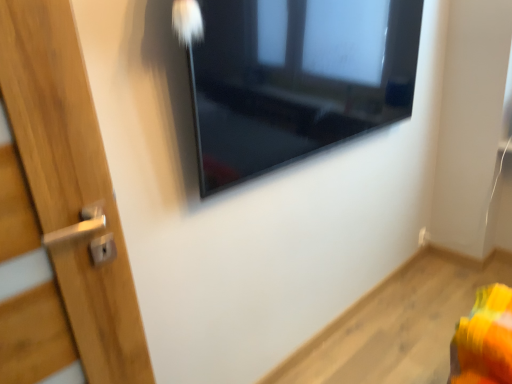
Question: Is white plastic electric outlet at lower right shorter than glossy glass window at upper center?

Choices:
 (A) yes
 (B) no

Answer: (A)

Question: Is white plastic electric outlet at lower right looking in the opposite direction of glossy glass window at upper center?

Choices:
 (A) no
 (B) yes

Answer: (A)

Question: Does white plastic electric outlet at lower right have a larger size compared to glossy glass window at upper center?

Choices:
 (A) no
 (B) yes

Answer: (A)

Question: Does white plastic electric outlet at lower right have a greater height compared to glossy glass window at upper center?

Choices:
 (A) no
 (B) yes

Answer: (A)

Question: From a real-world perspective, does white plastic electric outlet at lower right sit lower than glossy glass window at upper center?

Choices:
 (A) yes
 (B) no

Answer: (A)

Question: Considering the relative sizes of white plastic electric outlet at lower right and glossy glass window at upper center in the image provided, is white plastic electric outlet at lower right wider than glossy glass window at upper center?

Choices:
 (A) yes
 (B) no

Answer: (B)

Question: Does glossy glass window at upper center lie behind white plastic electric outlet at lower right?

Choices:
 (A) yes
 (B) no

Answer: (B)

Question: Is glossy glass window at upper center to the left of white plastic electric outlet at lower right from the viewer's perspective?

Choices:
 (A) no
 (B) yes

Answer: (B)

Question: Can white plastic electric outlet at lower right be found inside glossy glass window at upper center?

Choices:
 (A) yes
 (B) no

Answer: (B)

Question: Is glossy glass window at upper center completely or partially outside of white plastic electric outlet at lower right?

Choices:
 (A) no
 (B) yes

Answer: (B)

Question: Could you tell me if glossy glass window at upper center is facing white plastic electric outlet at lower right?

Choices:
 (A) yes
 (B) no

Answer: (B)

Question: Considering the relative sizes of glossy glass window at upper center and white plastic electric outlet at lower right in the image provided, is glossy glass window at upper center bigger than white plastic electric outlet at lower right?

Choices:
 (A) no
 (B) yes

Answer: (B)

Question: Is point (336, 26) closer or farther from the camera than point (422, 238)?

Choices:
 (A) closer
 (B) farther

Answer: (A)